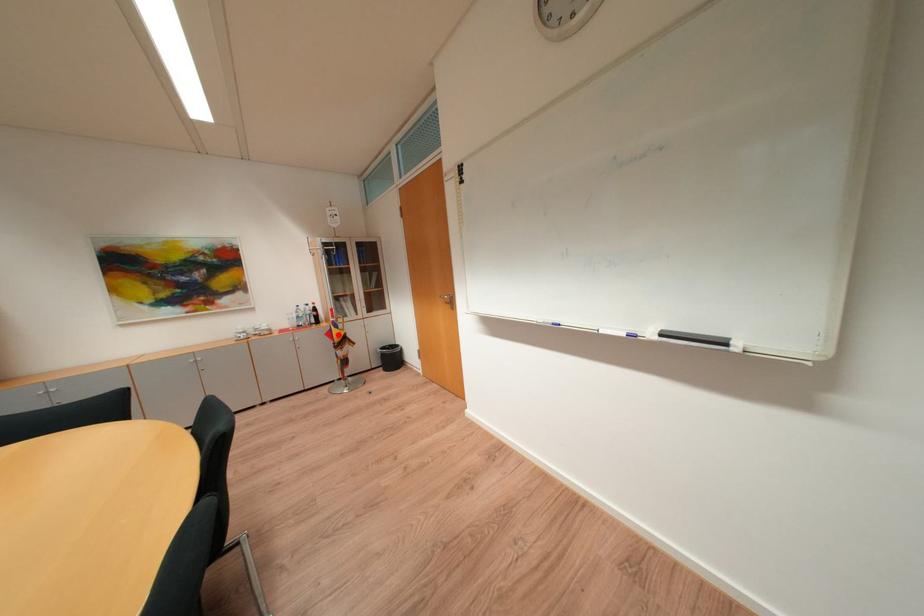
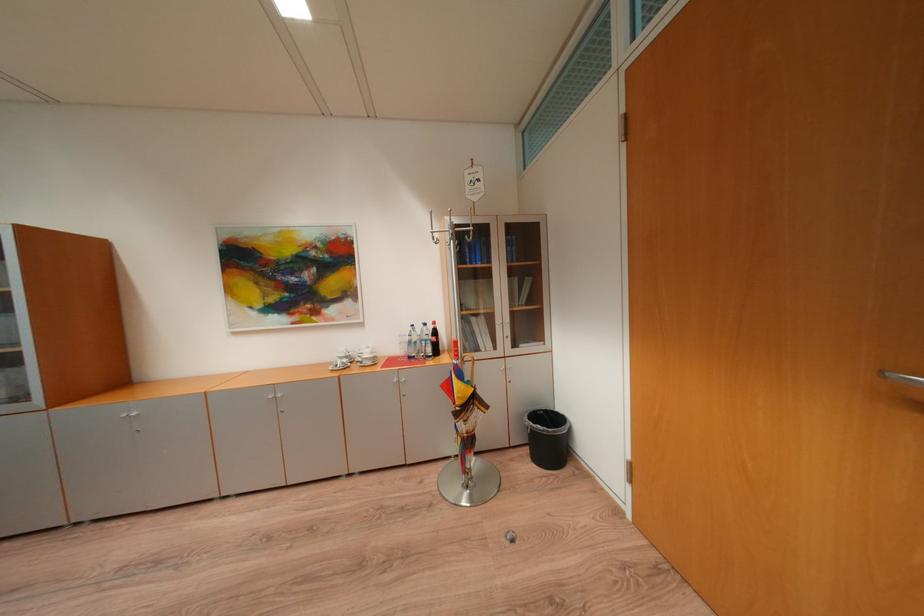
Question: I am providing you with two images of the same scene from different viewpoints. A red point is shown in image1. For the corresponding object point in image2, is it positioned nearer or farther from the camera?

Choices:
 (A) Nearer
 (B) Farther

Answer: (B)